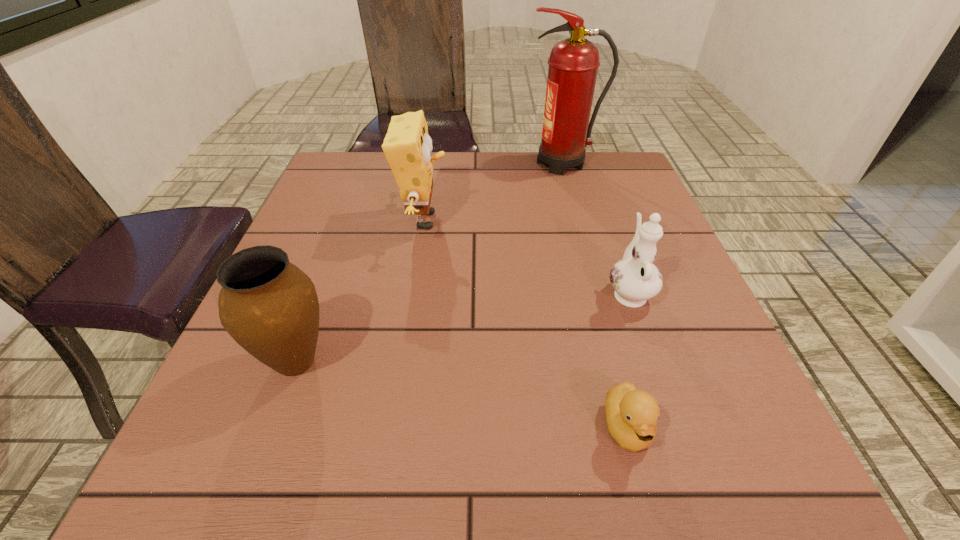
This screenshot has height=540, width=960. In order to click on object situated at the left edge in this screenshot , I will do `click(270, 307)`.

The image size is (960, 540). In order to click on fire extinguisher that is at the right edge in this screenshot , I will do `click(573, 63)`.

Where is `chinaware that is positioned at the right edge`? This screenshot has height=540, width=960. chinaware that is positioned at the right edge is located at coordinates (635, 279).

Find the location of `object situated at the far right corner`. object situated at the far right corner is located at coordinates (573, 63).

Where is `free location at the far edge`? Image resolution: width=960 pixels, height=540 pixels. free location at the far edge is located at coordinates (533, 180).

I want to click on free space at the near edge of the desktop, so click(x=571, y=499).

Locate an element on the screen. free spot at the left edge of the desktop is located at coordinates (x=349, y=269).

Locate an element on the screen. The image size is (960, 540). free space at the right edge of the desktop is located at coordinates (621, 223).

Where is `vacant region at the far left corner of the desktop`? The image size is (960, 540). vacant region at the far left corner of the desktop is located at coordinates (358, 168).

In the image, there is a desktop. At what (x,y) coordinates should I click in order to perform the action: click on free region at the far right corner. Please return your answer as a coordinate pair (x, y). This screenshot has height=540, width=960. Looking at the image, I should click on (584, 168).